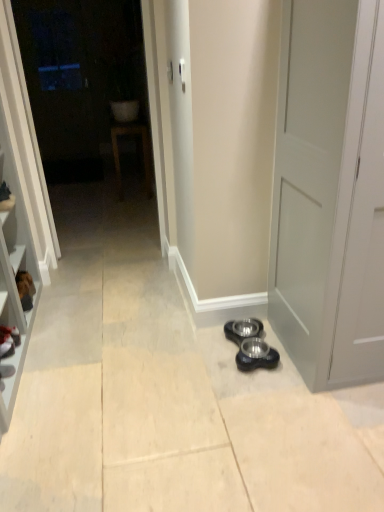
Question: From a real-world perspective, is satin silver door handle at upper center over matte white sink at upper center?

Choices:
 (A) yes
 (B) no

Answer: (A)

Question: From the image's perspective, is satin silver door handle at upper center located beneath matte white sink at upper center?

Choices:
 (A) yes
 (B) no

Answer: (A)

Question: Is satin silver door handle at upper center not within matte white sink at upper center?

Choices:
 (A) yes
 (B) no

Answer: (A)

Question: Considering the relative sizes of satin silver door handle at upper center and matte white sink at upper center in the image provided, is satin silver door handle at upper center bigger than matte white sink at upper center?

Choices:
 (A) yes
 (B) no

Answer: (B)

Question: Is satin silver door handle at upper center to the right of matte white sink at upper center from the viewer's perspective?

Choices:
 (A) yes
 (B) no

Answer: (A)

Question: From the image's perspective, relative to black rubber bowls at lower center, is transparent glass door at upper left above or below?

Choices:
 (A) above
 (B) below

Answer: (A)

Question: In the image, is transparent glass door at upper left on the left side or the right side of black rubber bowls at lower center?

Choices:
 (A) right
 (B) left

Answer: (B)

Question: Is transparent glass door at upper left bigger or smaller than black rubber bowls at lower center?

Choices:
 (A) small
 (B) big

Answer: (B)

Question: Is transparent glass door at upper left inside the boundaries of black rubber bowls at lower center, or outside?

Choices:
 (A) inside
 (B) outside

Answer: (B)

Question: From a real-world perspective, is matte white sink at upper center physically located above or below black rubber bowls at lower center?

Choices:
 (A) below
 (B) above

Answer: (B)

Question: In the image, is matte white sink at upper center positioned in front of or behind black rubber bowls at lower center?

Choices:
 (A) behind
 (B) front

Answer: (A)

Question: Considering the positions of point (124, 128) and point (241, 358), is point (124, 128) closer or farther from the camera than point (241, 358)?

Choices:
 (A) closer
 (B) farther

Answer: (B)

Question: Based on their positions, is matte white sink at upper center located to the left or right of black rubber bowls at lower center?

Choices:
 (A) right
 (B) left

Answer: (B)

Question: In terms of size, does black leather shoe at left appear bigger or smaller than transparent glass door at upper left?

Choices:
 (A) small
 (B) big

Answer: (A)

Question: Looking at their shapes, would you say black leather shoe at left is wider or thinner than transparent glass door at upper left?

Choices:
 (A) thin
 (B) wide

Answer: (B)